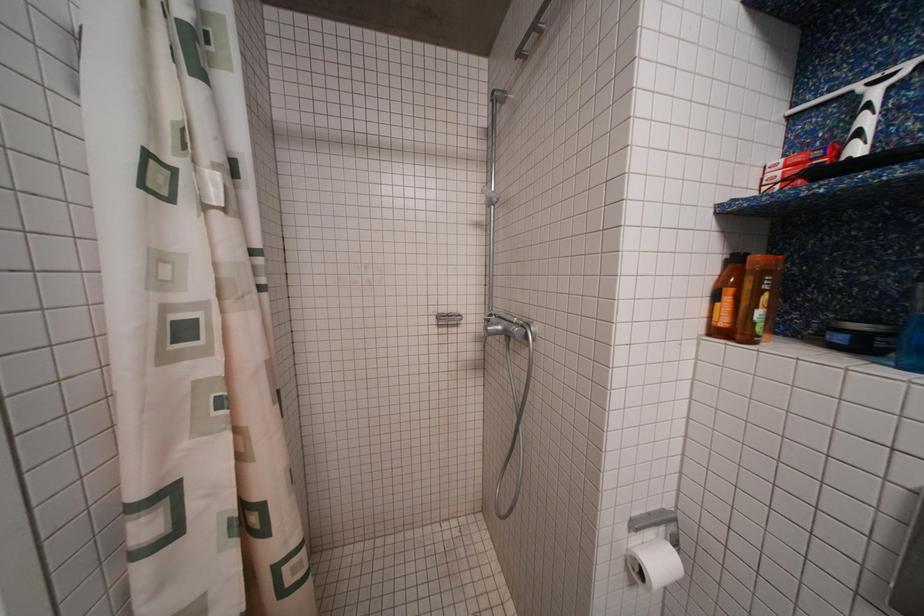
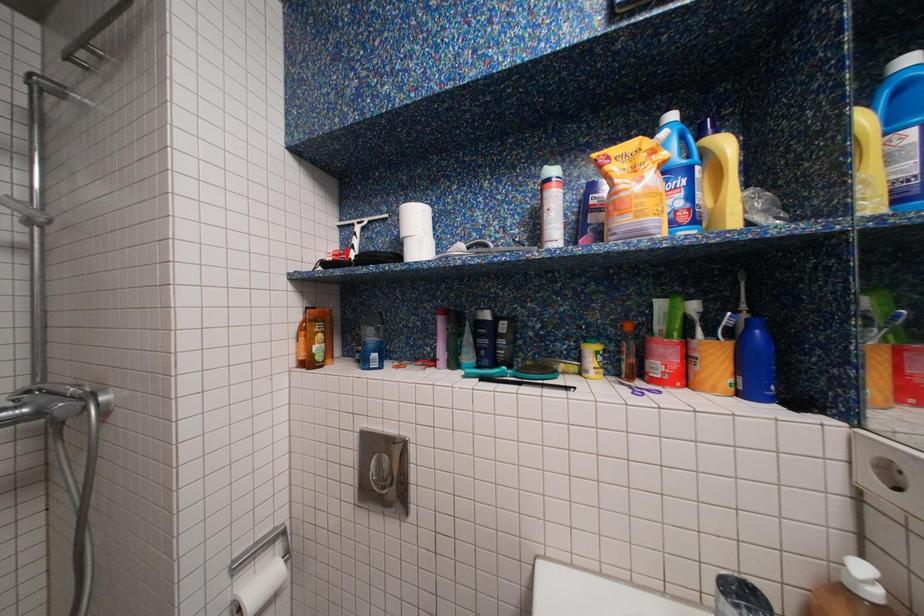
Question: The images are taken continuously from a first-person perspective. In which direction is your viewpoint rotating?

Choices:
 (A) Left
 (B) Right
 (C) Up
 (D) Down

Answer: (B)